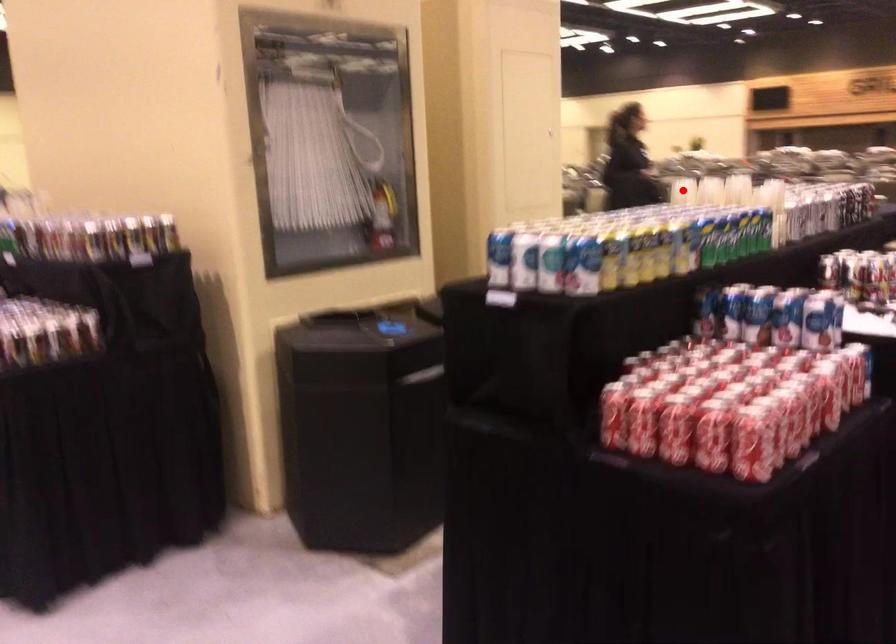
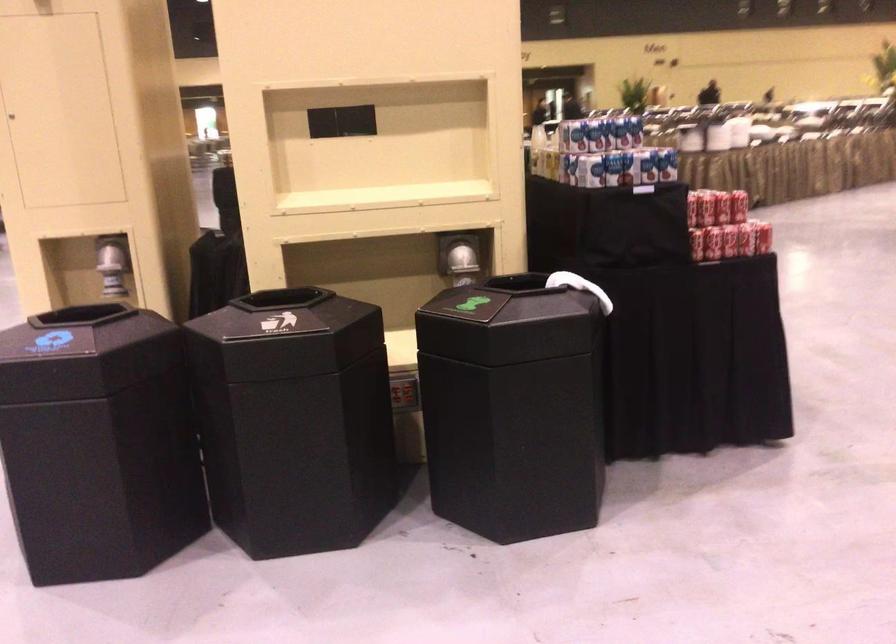
Question: I am providing you with two images of the same scene from different viewpoints. A red point is marked on the first image. Can you still see the location of the red point in image 2?

Choices:
 (A) Yes
 (B) No

Answer: (B)